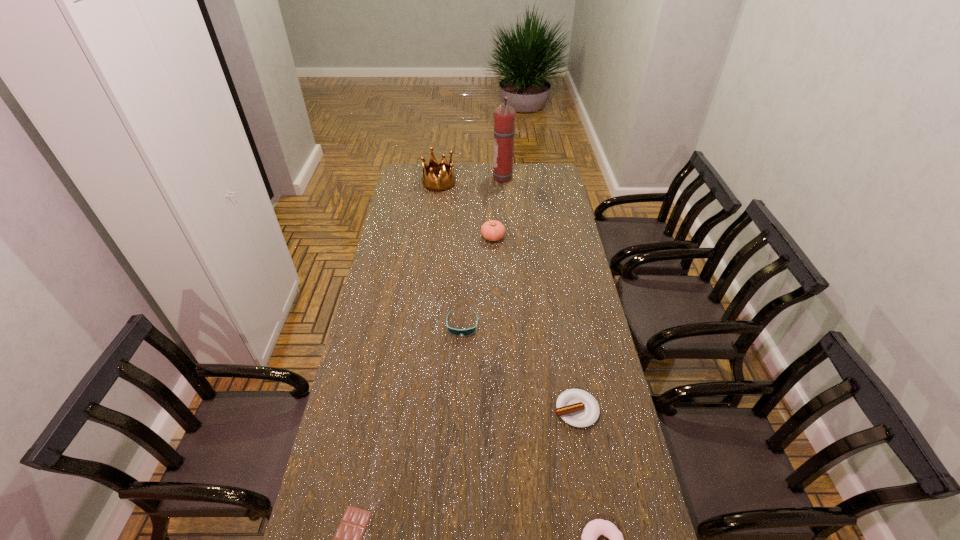
The width and height of the screenshot is (960, 540). In order to click on free space at the left edge in this screenshot , I will do `click(383, 291)`.

In the image, there is a desktop. Where is `blank space at the right edge`? This screenshot has width=960, height=540. blank space at the right edge is located at coordinates (596, 459).

In the image, there is a desktop. Identify the location of vacant space at the far right corner. The height and width of the screenshot is (540, 960). (563, 184).

What are the coordinates of `empty space between the sausage and the third farthest object` in the screenshot? It's located at (535, 323).

Where is `free space between the tallest object and the third tallest object`? free space between the tallest object and the third tallest object is located at coordinates (499, 208).

Locate an element on the screen. This screenshot has height=540, width=960. vacant area that lies between the crown and the third tallest object is located at coordinates (466, 210).

You are a GUI agent. You are given a task and a screenshot of the screen. Output one action in this format:
    pyautogui.click(x=<x>, y=<y>)
    Task: Click on the free space that is in between the third nearest object and the fourth farthest object
    The height and width of the screenshot is (540, 960).
    Given the screenshot: What is the action you would take?
    pyautogui.click(x=519, y=367)

Locate which object ranks fourth in proximity to the doughnut. Please provide its 2D coordinates. Your answer should be formatted as a tuple, i.e. [(x, y)], where the tuple contains the x and y coordinates of a point satisfying the conditions above.

[(492, 230)]

What are the coordinates of `object identified as the fourth closest to the shortest object` in the screenshot? It's located at (492, 230).

You are a GUI agent. You are given a task and a screenshot of the screen. Output one action in this format:
    pyautogui.click(x=<x>, y=<y>)
    Task: Click on the vacant space that satisfies the following two spatial constraints: 1. on the side of the fire extinguisher with the label and nozzle; 2. on the left side of the sausage
    
    Given the screenshot: What is the action you would take?
    pyautogui.click(x=522, y=409)